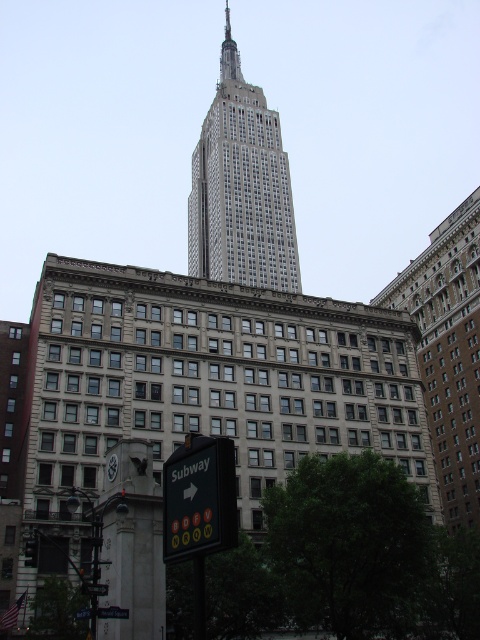
Is black plastic sign at lower center thinner than black plastic subway sign at lower center?

Yes, black plastic sign at lower center is thinner than black plastic subway sign at lower center.

Measure the distance from black plastic sign at lower center to black plastic subway sign at lower center.

black plastic sign at lower center is 1.22 meters away from black plastic subway sign at lower center.

What are the coordinates of `black plastic sign at lower center` in the screenshot? It's located at (112, 612).

Does white glass building at center appear under green plastic street sign at lower center?

Incorrect, white glass building at center is not positioned below green plastic street sign at lower center.

Based on the photo, is white glass building at center thinner than green plastic street sign at lower center?

In fact, white glass building at center might be wider than green plastic street sign at lower center.

Is point (265, 168) positioned behind point (90, 616)?

Yes, point (265, 168) is farther from viewer.

At what (x,y) coordinates should I click in order to perform the action: click on white glass building at center. Please return your answer as a coordinate pair (x, y). Image resolution: width=480 pixels, height=640 pixels. Looking at the image, I should click on (240, 188).

Can you confirm if white glass building at center is thinner than black plastic subway sign at lower center?

Incorrect, white glass building at center's width is not less than black plastic subway sign at lower center's.

The width and height of the screenshot is (480, 640). What are the coordinates of `white glass building at center` in the screenshot? It's located at (240, 188).

Which is in front, point (206, 192) or point (88, 586)?

Positioned in front is point (88, 586).

What are the coordinates of `white glass building at center` in the screenshot? It's located at (240, 188).